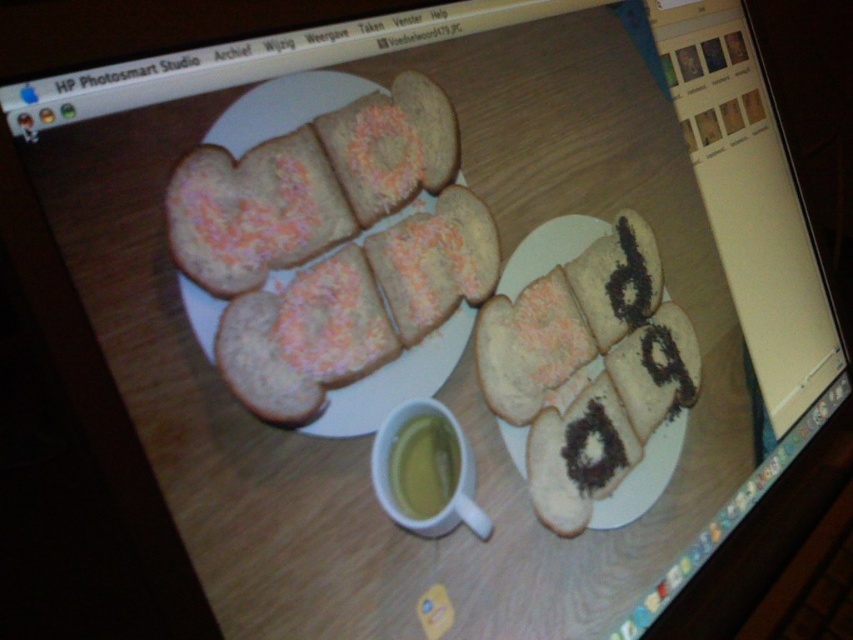
Consider the image. You are using HP Photosmart Studio to edit a photo of two plates of cookies and a cup. The white frosted cookies at center and the yellow translucent cup at center are in the same area. From your perspective in the software, which object is closer to you?

The white frosted cookies at center are closer because they are in front of the yellow translucent cup at center.

You are using HP Photosmart Studio to edit a photo of two plates of bread. You need to adjust the lighting for both plates. Which plate is closer to the viewer, the one at point [244,346] or the one at point [643,300]?

Point [244,346] is closer to the viewer than point [643,300], so the plate at point [244,346] is closer.

In the photo editing software, you need to adjust the size of the white frosted cookies at center and the yellow translucent cup at center so that they are the same width. Which object should you enlarge or shrink?

The white frosted cookies at center is currently larger than the yellow translucent cup at center. To make them the same width, you should shrink the white frosted cookies at center or enlarge the yellow translucent cup at center.